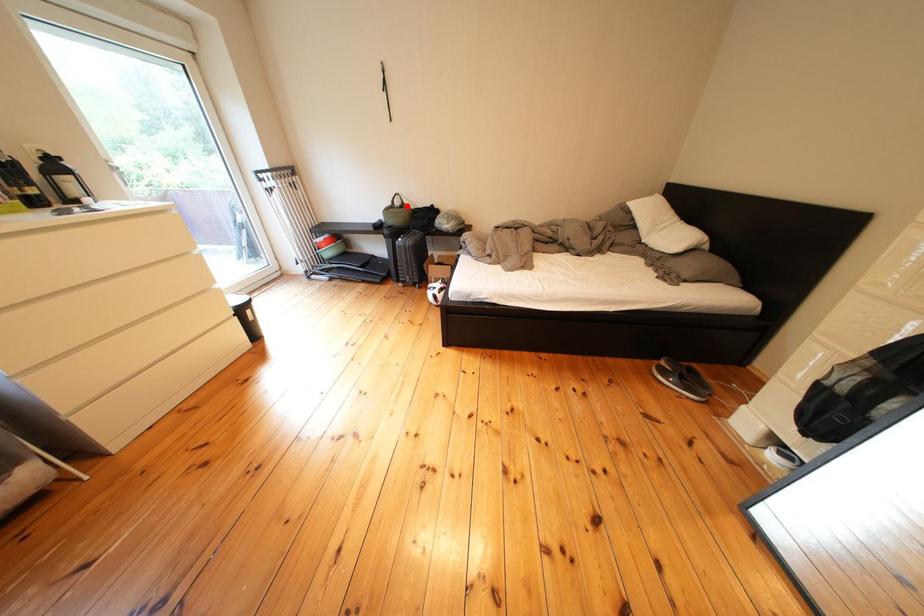
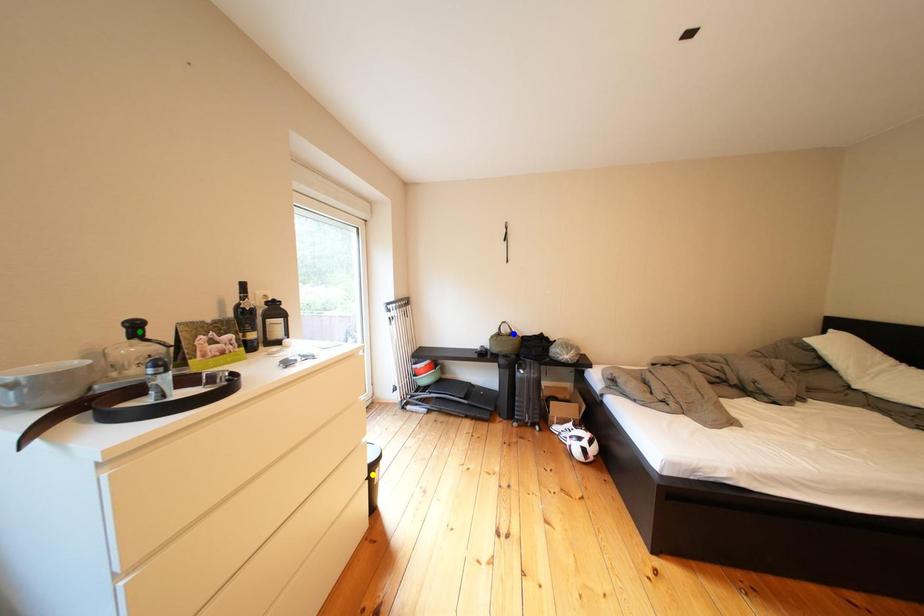
Question: I am providing you with two images of the same scene from different viewpoints. A red point is marked on the first image. You are given multiple points on the second image. Which spot in image 2 lines up with the point in image 1?

Choices:
 (A) green point
 (B) blue point
 (C) yellow point

Answer: (B)